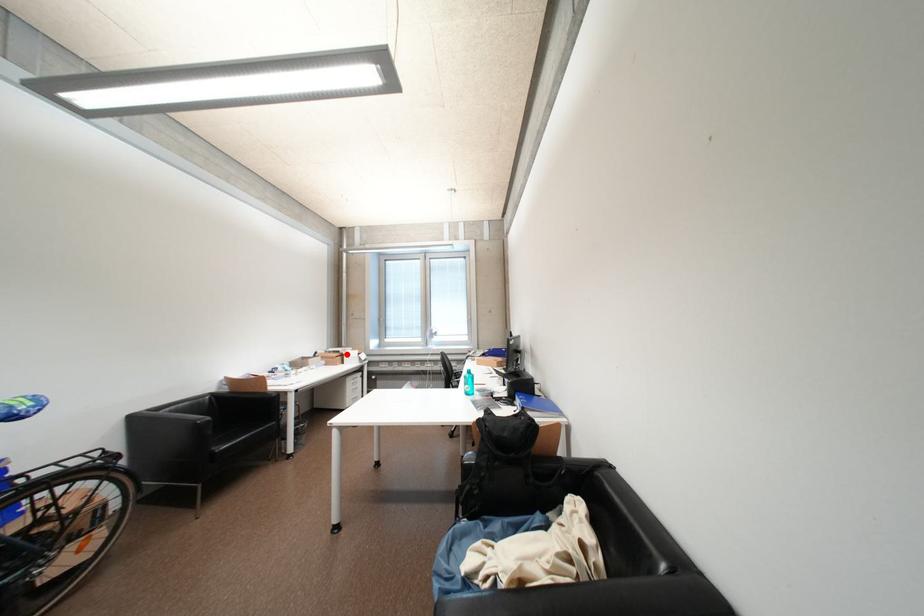
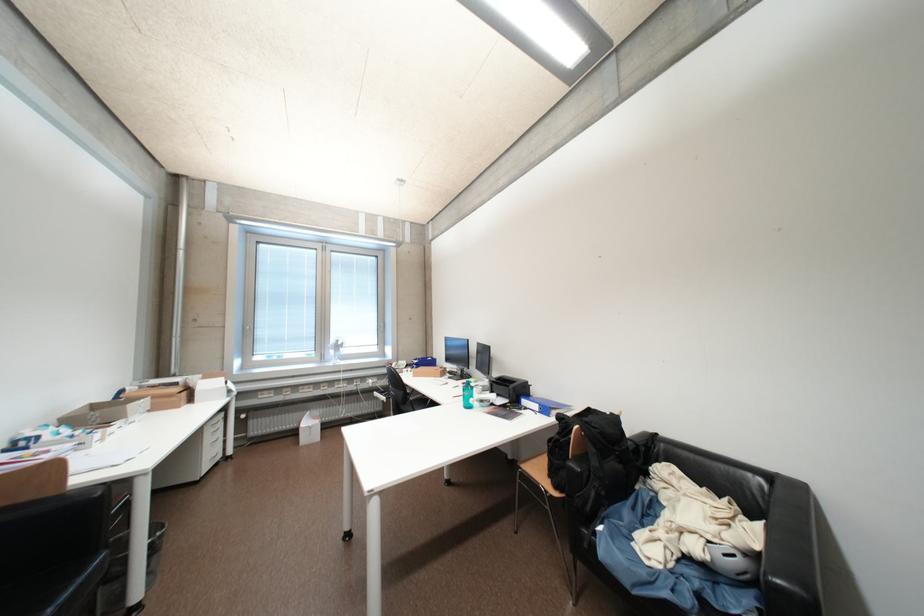
Locate, in the second image, the point that corresponds to the highlighted location in the first image.

(184, 386)